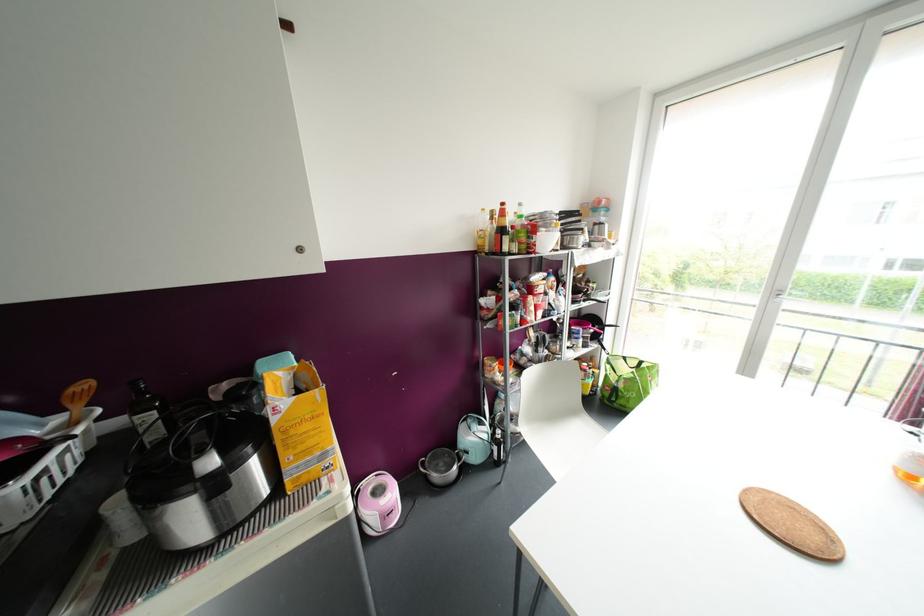
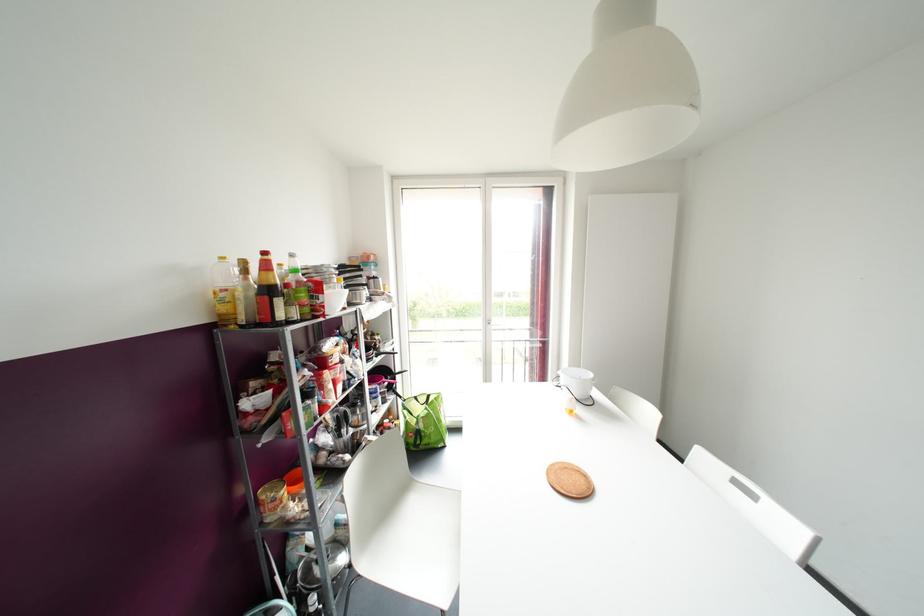
Question: The camera is either moving clockwise (left) or counter-clockwise (right) around the object. The first image is from the beginning of the video and the second image is from the end. Is the camera moving left or right when shooting the video?

Choices:
 (A) Left
 (B) Right

Answer: (A)